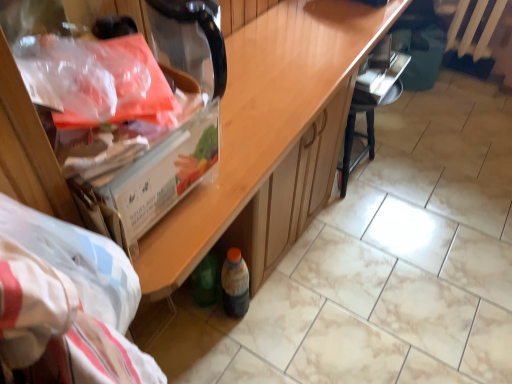
I want to click on translucent plastic bottle at lower center, so coord(234,284).

What do you see at coordinates (489, 29) in the screenshot? I see `metallic silver radiator at upper right` at bounding box center [489, 29].

You are a GUI agent. You are given a task and a screenshot of the screen. Output one action in this format:
    pyautogui.click(x=<x>, y=<y>)
    Task: Click on the black wood chair at center
    
    Given the screenshot: What is the action you would take?
    pyautogui.click(x=370, y=102)

Measure the distance between point (344, 169) and camera.

1.86 meters.

Where is `translucent plastic bag at upper left`? translucent plastic bag at upper left is located at coordinates (95, 80).

Measure the distance between translucent plastic bottle at lower center and metallic silver radiator at upper right.

They are 5.89 feet apart.

Consider the image. Which object is closer to the camera taking this photo, translucent plastic bottle at lower center or metallic silver radiator at upper right?

Positioned in front is translucent plastic bottle at lower center.

Is translucent plastic bottle at lower center turned away from metallic silver radiator at upper right?

No, translucent plastic bottle at lower center is not facing away from metallic silver radiator at upper right.

Considering the relative positions of translucent plastic bottle at lower center and metallic silver radiator at upper right in the image provided, is translucent plastic bottle at lower center to the left or to the right of metallic silver radiator at upper right?

Based on their positions, translucent plastic bottle at lower center is located to the left of metallic silver radiator at upper right.

In the scene shown: Is translucent plastic bag at upper left at the right side of metallic silver radiator at upper right?

Incorrect, translucent plastic bag at upper left is not on the right side of metallic silver radiator at upper right.

From a real-world perspective, is translucent plastic bag at upper left positioned over metallic silver radiator at upper right based on gravity?

Yes.

Is translucent plastic bag at upper left aimed at metallic silver radiator at upper right?

No, translucent plastic bag at upper left is not facing towards metallic silver radiator at upper right.

Would you say translucent plastic bag at upper left is a long distance from metallic silver radiator at upper right?

Yes.

Looking at this image, considering the relative positions of translucent plastic bag at upper left and black wood chair at center in the image provided, is translucent plastic bag at upper left behind black wood chair at center?

No, it is not.

Which is more to the right, translucent plastic bag at upper left or black wood chair at center?

From the viewer's perspective, black wood chair at center appears more on the right side.

From a real-world perspective, does translucent plastic bag at upper left stand above black wood chair at center?

Correct, in the physical world, translucent plastic bag at upper left is higher than black wood chair at center.

I want to click on material below the black wood chair at center (from the image's perspective), so click(95, 80).

From a real-world perspective, is black wood chair at center below translucent plastic bag at upper left?

Yes.

Which of these two, black wood chair at center or translucent plastic bag at upper left, is thinner?

black wood chair at center is thinner.

Can translucent plastic bag at upper left be found inside black wood chair at center?

No, translucent plastic bag at upper left is not inside black wood chair at center.

Is black wood chair at center next to translucent plastic bag at upper left and touching it?

No, black wood chair at center is not with translucent plastic bag at upper left.

Is translucent plastic bottle at lower center surrounding black wood chair at center?

No, translucent plastic bottle at lower center does not contain black wood chair at center.

Which of these two, translucent plastic bottle at lower center or black wood chair at center, is thinner?

translucent plastic bottle at lower center.

Is point (232, 248) behind point (353, 130)?

No, it is in front of (353, 130).

In the scene shown: Is translucent plastic bottle at lower center further to the viewer compared to black wood chair at center?

No, it is not.

Between metallic silver radiator at upper right and black wood chair at center, which one has larger size?

Bigger between the two is black wood chair at center.

Could you tell me if metallic silver radiator at upper right is facing black wood chair at center?

Yes, metallic silver radiator at upper right faces towards black wood chair at center.

From the image's perspective, which object appears higher, metallic silver radiator at upper right or black wood chair at center?

From the image's view, metallic silver radiator at upper right is above.

Considering the positions of objects metallic silver radiator at upper right and black wood chair at center in the image provided, who is behind, metallic silver radiator at upper right or black wood chair at center?

Positioned behind is metallic silver radiator at upper right.

Which is more to the left, translucent plastic bottle at lower center or translucent plastic bag at upper left?

Positioned to the left is translucent plastic bag at upper left.

From the picture: Can you confirm if translucent plastic bottle at lower center is taller than translucent plastic bag at upper left?

Yes.

Is translucent plastic bottle at lower center smaller than translucent plastic bag at upper left?

No.

Is the position of translucent plastic bottle at lower center less distant than that of translucent plastic bag at upper left?

No.

The image size is (512, 384). Identify the location of radiator lying behind the translucent plastic bottle at lower center. (489, 29).

I want to click on radiator on the right of translucent plastic bag at upper left, so click(489, 29).

From the image, which object appears to be farther from metallic silver radiator at upper right, black wood chair at center or translucent plastic bag at upper left?

Among the two, translucent plastic bag at upper left is located further to metallic silver radiator at upper right.

When comparing their distances from translucent plastic bottle at lower center, does metallic silver radiator at upper right or black wood chair at center seem further?

Based on the image, metallic silver radiator at upper right appears to be further to translucent plastic bottle at lower center.

Looking at the image, which one is located closer to metallic silver radiator at upper right, translucent plastic bottle at lower center or black wood chair at center?

black wood chair at center is positioned closer to the anchor metallic silver radiator at upper right.

From the image, which object appears to be farther from metallic silver radiator at upper right, black wood chair at center or translucent plastic bottle at lower center?

translucent plastic bottle at lower center lies further to metallic silver radiator at upper right than the other object.

In the scene shown: Looking at the image, which one is located closer to translucent plastic bag at upper left, black wood chair at center or translucent plastic bottle at lower center?

translucent plastic bottle at lower center is positioned closer to the anchor translucent plastic bag at upper left.

Considering their positions, is translucent plastic bottle at lower center positioned further to black wood chair at center than metallic silver radiator at upper right?

metallic silver radiator at upper right lies further to black wood chair at center than the other object.

Estimate the real-world distances between objects in this image. Which object is further from metallic silver radiator at upper right, translucent plastic bag at upper left or translucent plastic bottle at lower center?

translucent plastic bag at upper left lies further to metallic silver radiator at upper right than the other object.

From the picture: From the image, which object appears to be farther from translucent plastic bottle at lower center, translucent plastic bag at upper left or black wood chair at center?

The object further to translucent plastic bottle at lower center is black wood chair at center.

Find the location of a particular element. wine bottle located between translucent plastic bag at upper left and black wood chair at center in the depth direction is located at coordinates (234, 284).

The width and height of the screenshot is (512, 384). Find the location of `wine bottle between translucent plastic bag at upper left and metallic silver radiator at upper right in the horizontal direction`. wine bottle between translucent plastic bag at upper left and metallic silver radiator at upper right in the horizontal direction is located at coordinates (234, 284).

Where is `chair located between translucent plastic bag at upper left and metallic silver radiator at upper right in the depth direction`? This screenshot has width=512, height=384. chair located between translucent plastic bag at upper left and metallic silver radiator at upper right in the depth direction is located at coordinates (x=370, y=102).

This screenshot has width=512, height=384. Find the location of `chair between translucent plastic bottle at lower center and metallic silver radiator at upper right from left to right`. chair between translucent plastic bottle at lower center and metallic silver radiator at upper right from left to right is located at coordinates (370, 102).